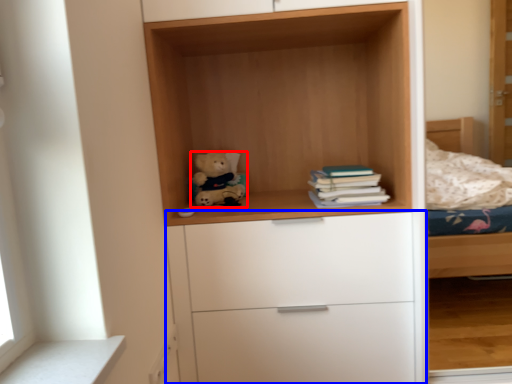
Question: Among these objects, which one is nearest to the camera, teddy bear (highlighted by a red box) or chest of drawers (highlighted by a blue box)?

Choices:
 (A) teddy bear
 (B) chest of drawers

Answer: (B)